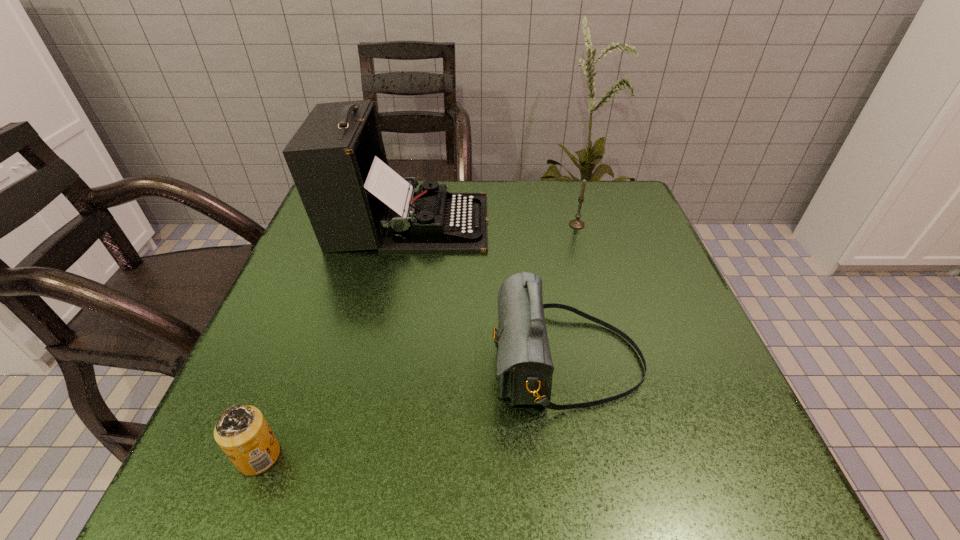
Identify the location of vacant space at the far edge of the desktop. (525, 212).

You are a GUI agent. You are given a task and a screenshot of the screen. Output one action in this format:
    pyautogui.click(x=<x>, y=<y>)
    Task: Click on the vacant space at the near edge of the desktop
    The height and width of the screenshot is (540, 960).
    Given the screenshot: What is the action you would take?
    pyautogui.click(x=549, y=460)

Where is `free space at the left edge of the desktop`? Image resolution: width=960 pixels, height=540 pixels. free space at the left edge of the desktop is located at coordinates (287, 386).

Find the location of a particular element. Image resolution: width=960 pixels, height=540 pixels. free space at the right edge of the desktop is located at coordinates (639, 258).

Identify the location of free space at the near left corner. This screenshot has width=960, height=540. (204, 444).

At what (x,y) coordinates should I click in order to perform the action: click on free region at the far right corner of the desktop. Please return your answer as a coordinate pair (x, y). The height and width of the screenshot is (540, 960). Looking at the image, I should click on (623, 196).

Image resolution: width=960 pixels, height=540 pixels. I want to click on free space between the candle and the second tallest object, so click(572, 293).

At what (x,y) coordinates should I click in order to perform the action: click on vacant area that lies between the third farthest object and the nearest object. Please return your answer as a coordinate pair (x, y). The width and height of the screenshot is (960, 540). Looking at the image, I should click on (413, 409).

The width and height of the screenshot is (960, 540). In order to click on vacant area between the typewriter and the second nearest object in this screenshot , I will do `click(488, 292)`.

Image resolution: width=960 pixels, height=540 pixels. I want to click on vacant space that's between the nearest object and the tallest object, so click(x=333, y=339).